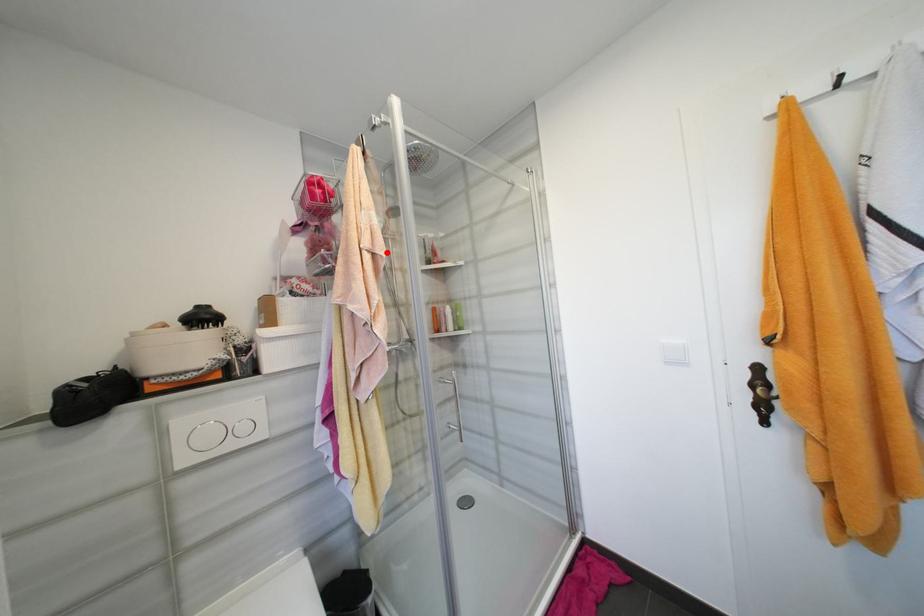
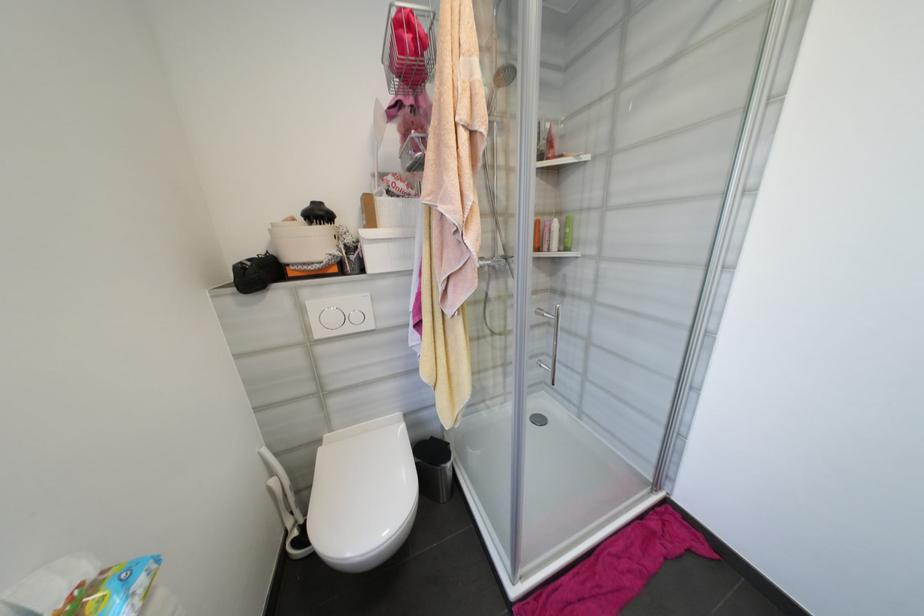
In the second image, find the point that corresponds to the highlighted location in the first image.

(488, 127)